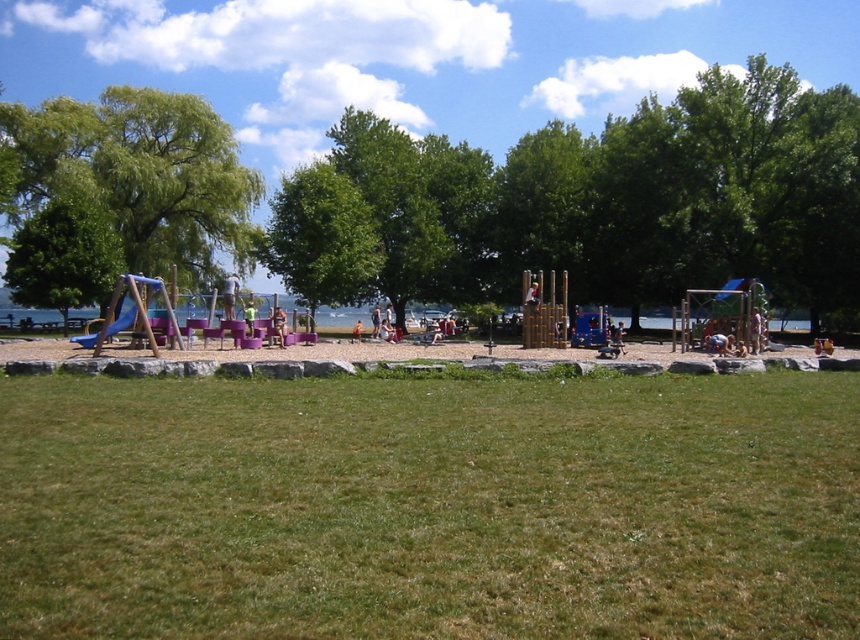
Who is taller, green grass at lower center or blue rubber slide at left?

With more height is blue rubber slide at left.

Between green grass at lower center and blue rubber slide at left, which one has less height?

green grass at lower center

Which is behind, point (613, 627) or point (83, 342)?

The point (83, 342) is more distant.

The width and height of the screenshot is (860, 640). In order to click on green grass at lower center in this screenshot , I will do `click(430, 506)`.

Does green leafy tree at left appear over gravelly sand at center?

Correct, green leafy tree at left is located above gravelly sand at center.

Describe the element at coordinates (121, 193) in the screenshot. I see `green leafy tree at left` at that location.

Is point (34, 186) positioned after point (317, 349)?

That is True.

This screenshot has height=640, width=860. In order to click on green leafy tree at left in this screenshot , I will do `click(121, 193)`.

In the scene shown: Can you confirm if green leafy tree at left is taller than blue rubber slide at left?

Indeed, green leafy tree at left has a greater height compared to blue rubber slide at left.

The width and height of the screenshot is (860, 640). What do you see at coordinates (121, 193) in the screenshot? I see `green leafy tree at left` at bounding box center [121, 193].

The height and width of the screenshot is (640, 860). Describe the element at coordinates (121, 193) in the screenshot. I see `green leafy tree at left` at that location.

Locate an element on the screen. The height and width of the screenshot is (640, 860). green leafy tree at left is located at coordinates (121, 193).